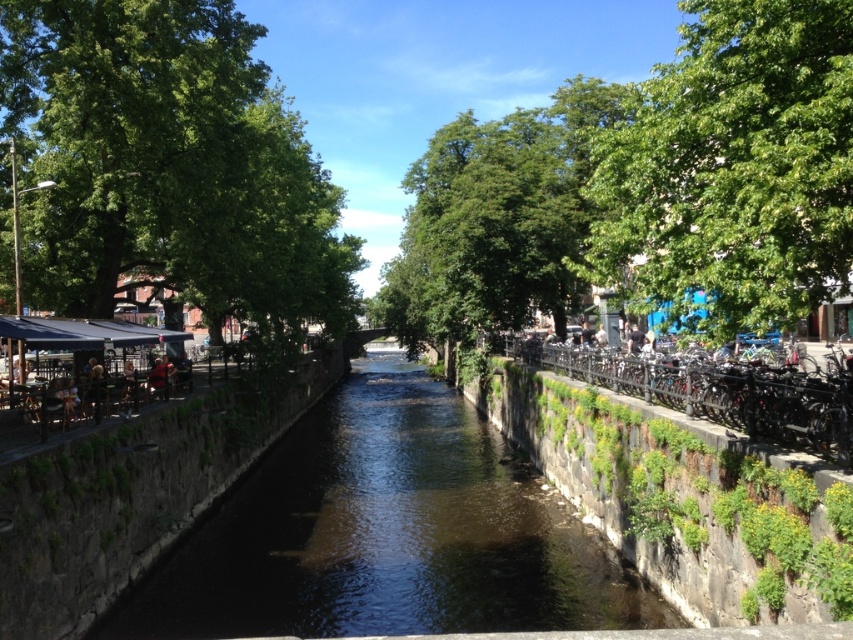
Question: Is green leafy tree at left smaller than green leafy tree at upper right?

Choices:
 (A) yes
 (B) no

Answer: (B)

Question: Among these objects, which one is farthest from the camera?

Choices:
 (A) green leafy tree at upper right
 (B) dark stone river at center
 (C) green leafy tree at left

Answer: (C)

Question: Is green leafy tree at left positioned at the back of green leafy tree at upper right?

Choices:
 (A) yes
 (B) no

Answer: (A)

Question: Can you confirm if green leafy tree at left is thinner than green leafy tree at upper right?

Choices:
 (A) no
 (B) yes

Answer: (A)

Question: Among these points, which one is farthest from the camera?

Choices:
 (A) (148, 84)
 (B) (625, 147)
 (C) (372, 547)

Answer: (A)

Question: Which object is the farthest from the green leafy tree at left?

Choices:
 (A) dark stone river at center
 (B) green leafy tree at upper right

Answer: (B)